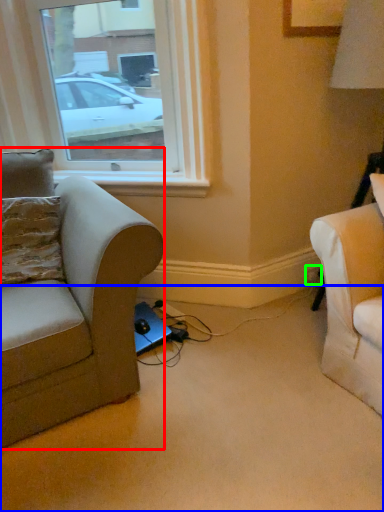
Question: Based on their relative distances, which object is nearer to studio couch (highlighted by a red box)? Choose from plain (highlighted by a blue box) and electric outlet (highlighted by a green box).

Choices:
 (A) plain
 (B) electric outlet

Answer: (A)